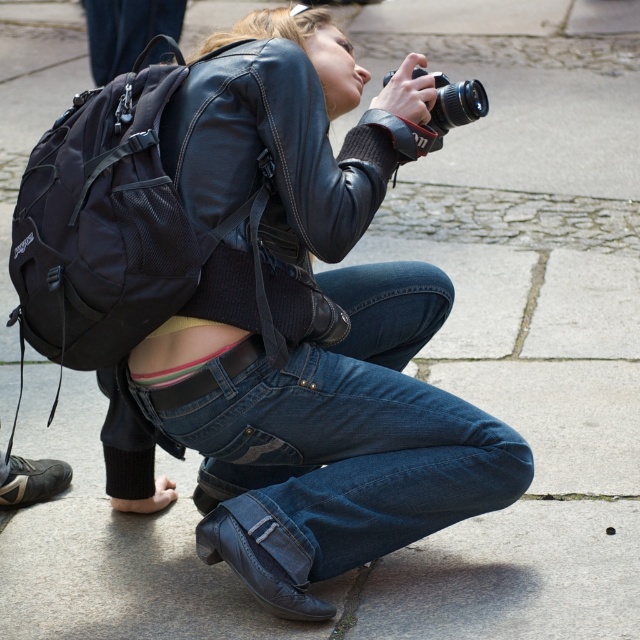
Question: Which object is the closest to the black matte camera at upper center?

Choices:
 (A) denim at center
 (B) black mesh backpack at upper left

Answer: (B)

Question: Considering the real-world distances, which object is closest to the denim at center?

Choices:
 (A) black mesh backpack at upper left
 (B) black matte camera at upper center

Answer: (A)

Question: Is denim at center positioned at the back of black mesh backpack at upper left?

Choices:
 (A) no
 (B) yes

Answer: (B)

Question: Does black mesh backpack at upper left appear on the right side of black matte camera at upper center?

Choices:
 (A) yes
 (B) no

Answer: (B)

Question: Among these objects, which one is nearest to the camera?

Choices:
 (A) black matte camera at upper center
 (B) denim at center

Answer: (B)

Question: Does denim at center have a greater width compared to black matte camera at upper center?

Choices:
 (A) yes
 (B) no

Answer: (A)